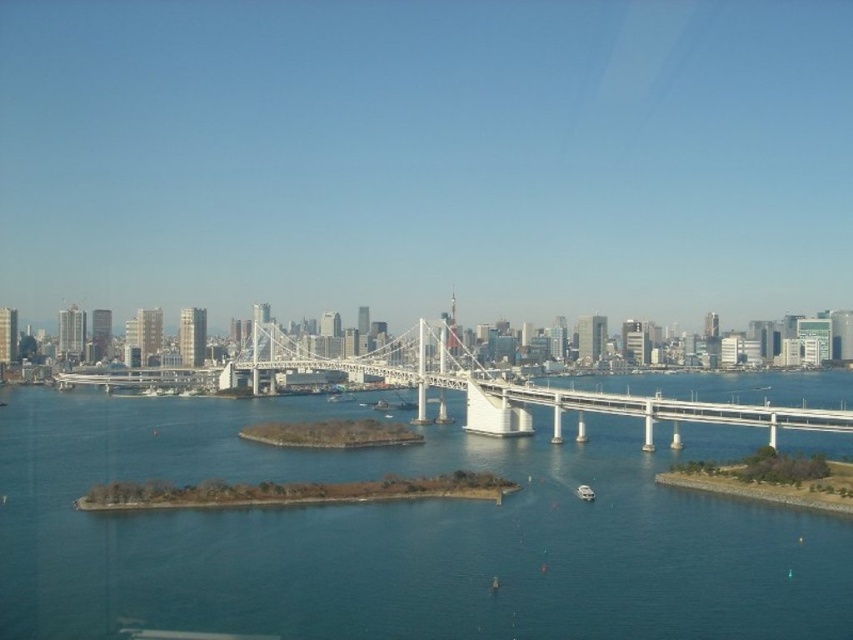
You are a photographer planning to capture the cityscape with both the blue water at center and the white metallic bridge at center in your shot. Based on their positions, which object should you position closer to the left side of your camera frame to include both in the composition?

The blue water at center is to the right of the white metallic bridge at center. To include both in the composition, you should position the white metallic bridge at center closer to the left side of your camera frame so that the blue water at center can be placed to its right within the frame.

You are a boat captain navigating through the blue water at center. You need to pass under the white metallic bridge at center. Can you safely do so without hitting the bridge?

The blue water at center is positioned under the white metallic bridge at center, which means there is clearance for the boat to pass underneath safely.

You are a drone operator tasked with flying a drone from the blue water at center to the white metallic bridge at center. The drone has a maximum flight range of 25 meters. Based on the scene, can the drone complete this flight without needing to recharge?

The blue water at center and white metallic bridge at center are 27.96 meters apart from each other. Since the drone can only fly 25 meters before needing to recharge, it cannot complete the flight without recharging.